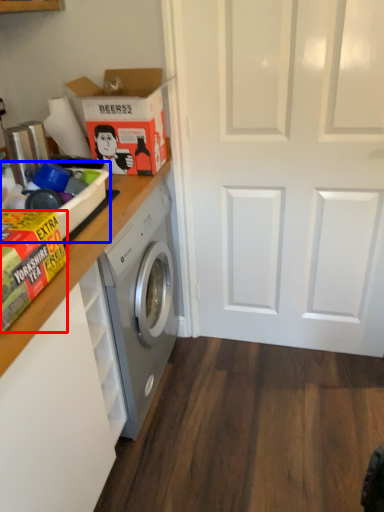
Question: Which object is further to the camera taking this photo, cardboard box (highlighted by a red box) or box (highlighted by a blue box)?

Choices:
 (A) cardboard box
 (B) box

Answer: (B)